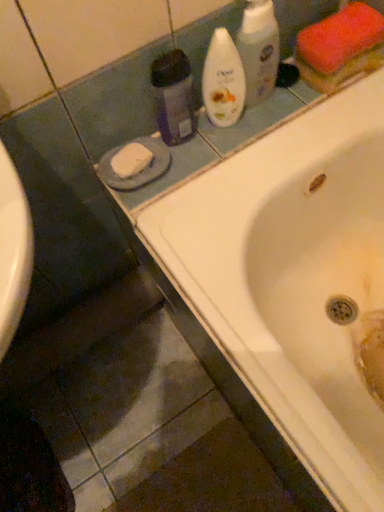
Question: Considering the relative sizes of translucent purple bottle at upper center, acting as the third cleaning product starting from the right, and white glossy bottle at upper center, which ranks as the third cleaning product in left-to-right order, in the image provided, is translucent purple bottle at upper center, acting as the third cleaning product starting from the right, smaller than white glossy bottle at upper center, which ranks as the third cleaning product in left-to-right order,?

Choices:
 (A) yes
 (B) no

Answer: (A)

Question: Is the depth of translucent purple bottle at upper center, which is counted as the first cleaning product, starting from the left, less than that of white glossy bottle at upper center, which appears as the 1th cleaning product when viewed from the right?

Choices:
 (A) yes
 (B) no

Answer: (A)

Question: Considering the relative sizes of translucent purple bottle at upper center, which is counted as the first cleaning product, starting from the left, and white glossy bottle at upper center, which ranks as the third cleaning product in left-to-right order, in the image provided, is translucent purple bottle at upper center, which is counted as the first cleaning product, starting from the left, wider than white glossy bottle at upper center, which ranks as the third cleaning product in left-to-right order,?

Choices:
 (A) no
 (B) yes

Answer: (B)

Question: Considering the relative sizes of translucent purple bottle at upper center, which is counted as the first cleaning product, starting from the left, and white glossy bottle at upper center, which appears as the 1th cleaning product when viewed from the right, in the image provided, is translucent purple bottle at upper center, which is counted as the first cleaning product, starting from the left, taller than white glossy bottle at upper center, which appears as the 1th cleaning product when viewed from the right,?

Choices:
 (A) yes
 (B) no

Answer: (B)

Question: Is translucent purple bottle at upper center, which is counted as the first cleaning product, starting from the left, at the right side of white glossy bottle at upper center, which ranks as the third cleaning product in left-to-right order?

Choices:
 (A) yes
 (B) no

Answer: (B)

Question: Is translucent purple bottle at upper center, which is counted as the first cleaning product, starting from the left, next to white glossy bottle at upper center, which ranks as the third cleaning product in left-to-right order, and touching it?

Choices:
 (A) yes
 (B) no

Answer: (B)

Question: Does translucent purple bottle at upper center, which is counted as the first cleaning product, starting from the left, have a lesser width compared to white glossy bottle at upper center, marked as the 2th cleaning product in a right-to-left arrangement?

Choices:
 (A) no
 (B) yes

Answer: (B)

Question: Is translucent purple bottle at upper center, which is counted as the first cleaning product, starting from the left, at the left side of white glossy bottle at upper center, marked as the 2th cleaning product in a right-to-left arrangement?

Choices:
 (A) no
 (B) yes

Answer: (B)

Question: Is translucent purple bottle at upper center, acting as the third cleaning product starting from the right, facing away from white glossy bottle at upper center, marked as the 2th cleaning product in a right-to-left arrangement?

Choices:
 (A) no
 (B) yes

Answer: (A)

Question: From a real-world perspective, is translucent purple bottle at upper center, acting as the third cleaning product starting from the right, below white glossy bottle at upper center, marked as the 2th cleaning product in a right-to-left arrangement?

Choices:
 (A) no
 (B) yes

Answer: (B)

Question: Considering the relative positions of translucent purple bottle at upper center, acting as the third cleaning product starting from the right, and white glossy bottle at upper center, which is the 2th cleaning product in left-to-right order, in the image provided, is translucent purple bottle at upper center, acting as the third cleaning product starting from the right, in front of white glossy bottle at upper center, which is the 2th cleaning product in left-to-right order,?

Choices:
 (A) no
 (B) yes

Answer: (B)

Question: Can you confirm if translucent purple bottle at upper center, acting as the third cleaning product starting from the right, is smaller than white glossy bottle at upper center, which is the 2th cleaning product in left-to-right order?

Choices:
 (A) no
 (B) yes

Answer: (B)

Question: From a real-world perspective, is white glossy bottle at upper center, which is the 2th cleaning product in left-to-right order, located higher than white glossy bathtub at upper center?

Choices:
 (A) no
 (B) yes

Answer: (B)